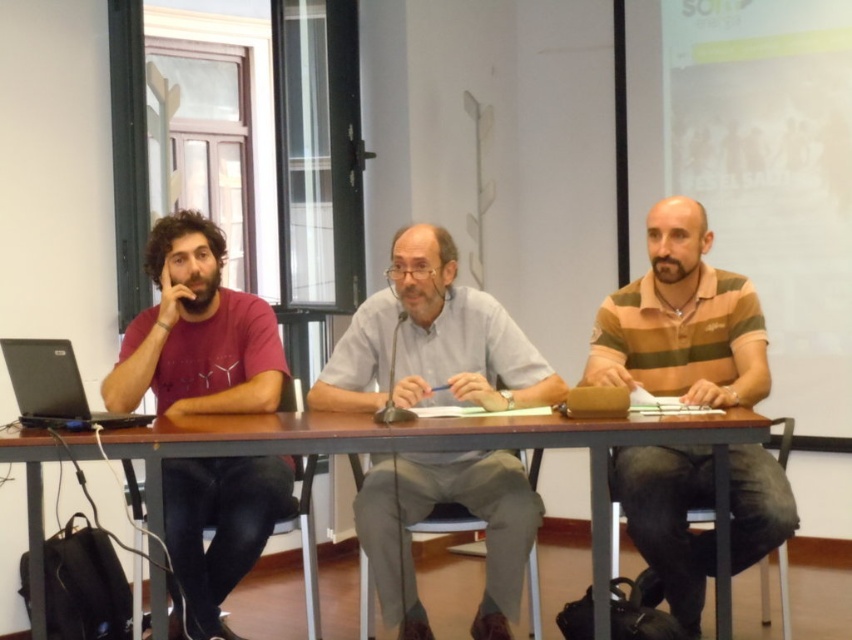
Can you confirm if gray cotton shirt at center is shorter than black plastic stool at lower right?

Incorrect, gray cotton shirt at center's height does not fall short of black plastic stool at lower right's.

Is gray cotton shirt at center smaller than black plastic stool at lower right?

No.

At what (x,y) coordinates should I click in order to perform the action: click on gray cotton shirt at center. Please return your answer as a coordinate pair (x, y). Looking at the image, I should click on (430, 340).

Measure the distance between matte red shirt at left and black matte laptop at left.

A distance of 14.05 inches exists between matte red shirt at left and black matte laptop at left.

The image size is (852, 640). What do you see at coordinates (196, 332) in the screenshot?
I see `matte red shirt at left` at bounding box center [196, 332].

The image size is (852, 640). What are the coordinates of `matte red shirt at left` in the screenshot? It's located at (196, 332).

Does point (753, 353) come closer to viewer compared to point (458, 516)?

That is True.

Does striped cotton polo shirt at right lie behind light brown wooden stool at center?

A: No.

Image resolution: width=852 pixels, height=640 pixels. I want to click on striped cotton polo shirt at right, so click(682, 321).